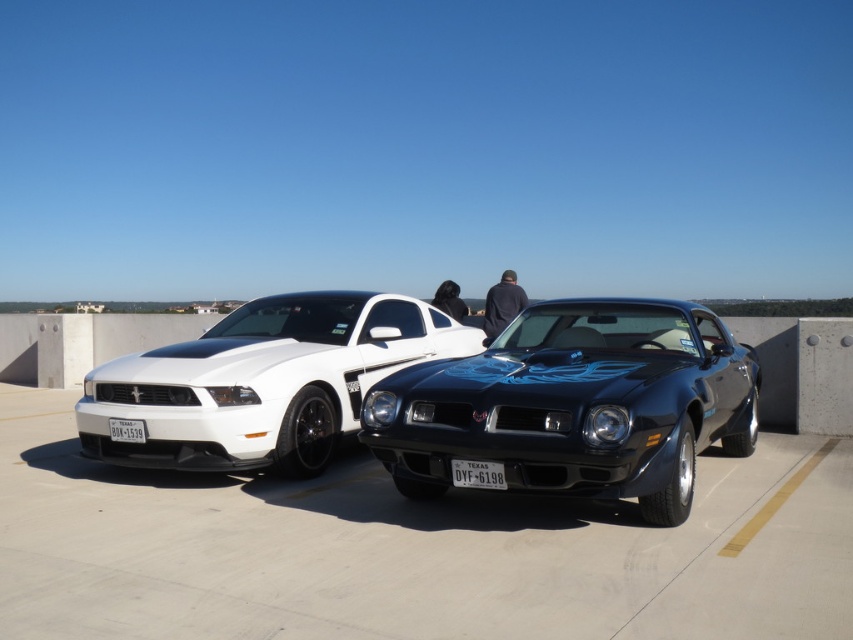
Image resolution: width=853 pixels, height=640 pixels. What do you see at coordinates (575, 404) in the screenshot?
I see `shiny black muscle car at center` at bounding box center [575, 404].

Does shiny black muscle car at center have a smaller size compared to black plastic license plate at center?

No, shiny black muscle car at center is not smaller than black plastic license plate at center.

Is point (410, 440) positioned in front of point (461, 484)?

No.

I want to click on shiny black muscle car at center, so click(x=575, y=404).

Is white glossy sports car at left positioned before black plastic license plate at center?

No, it is not.

Does white glossy sports car at left have a greater width compared to black plastic license plate at center?

Indeed, white glossy sports car at left has a greater width compared to black plastic license plate at center.

Between point (341, 344) and point (473, 465), which one is positioned behind?

The point (341, 344) is behind.

Where is `white glossy sports car at left`? white glossy sports car at left is located at coordinates (263, 381).

Who is taller, black plastic license plate at center or white plastic license plate at center?

black plastic license plate at center is taller.

Who is more distant from viewer, (459,467) or (138,419)?

The point (138,419) is more distant.

Is point (482, 460) positioned behind point (109, 436)?

No, (482, 460) is in front of (109, 436).

Find the location of a particular element. This screenshot has height=640, width=853. black plastic license plate at center is located at coordinates (477, 474).